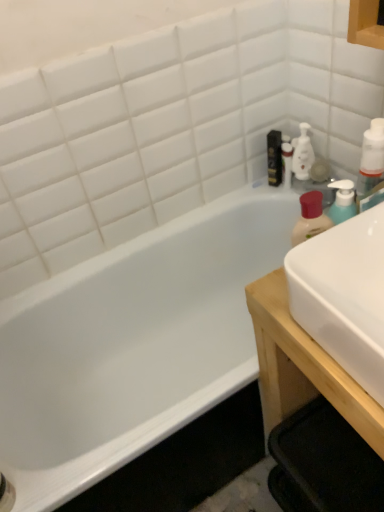
Question: Should I look upward or downward to see white glossy bottle at upper right?

Choices:
 (A) up
 (B) down

Answer: (A)

Question: Is white glossy sink at right facing away from black glossy bottle at upper right?

Choices:
 (A) yes
 (B) no

Answer: (B)

Question: From the image's perspective, is white glossy sink at right located beneath black glossy bottle at upper right?

Choices:
 (A) no
 (B) yes

Answer: (B)

Question: Can you confirm if white glossy sink at right is smaller than black glossy bottle at upper right?

Choices:
 (A) yes
 (B) no

Answer: (B)

Question: Is white glossy sink at right surrounding black glossy bottle at upper right?

Choices:
 (A) no
 (B) yes

Answer: (A)

Question: From a real-world perspective, is white glossy sink at right positioned under black glossy bottle at upper right based on gravity?

Choices:
 (A) yes
 (B) no

Answer: (B)

Question: Does white glossy sink at right appear on the right side of black glossy bottle at upper right?

Choices:
 (A) no
 (B) yes

Answer: (B)

Question: Does white glossy bathtub at left have a smaller size compared to white plastic bottle at upper right?

Choices:
 (A) no
 (B) yes

Answer: (A)

Question: Is the surface of white glossy bathtub at left in direct contact with white plastic bottle at upper right?

Choices:
 (A) no
 (B) yes

Answer: (A)

Question: Is white glossy bathtub at left thinner than white plastic bottle at upper right?

Choices:
 (A) yes
 (B) no

Answer: (B)

Question: Does white glossy bathtub at left have a larger size compared to white plastic bottle at upper right?

Choices:
 (A) yes
 (B) no

Answer: (A)

Question: Is the depth of white glossy bathtub at left less than that of white plastic bottle at upper right?

Choices:
 (A) no
 (B) yes

Answer: (A)

Question: Can you confirm if white glossy bathtub at left is positioned to the left of white plastic bottle at upper right?

Choices:
 (A) yes
 (B) no

Answer: (A)

Question: Does black glossy bottle at upper right come in front of white glossy bottle at upper right?

Choices:
 (A) yes
 (B) no

Answer: (B)